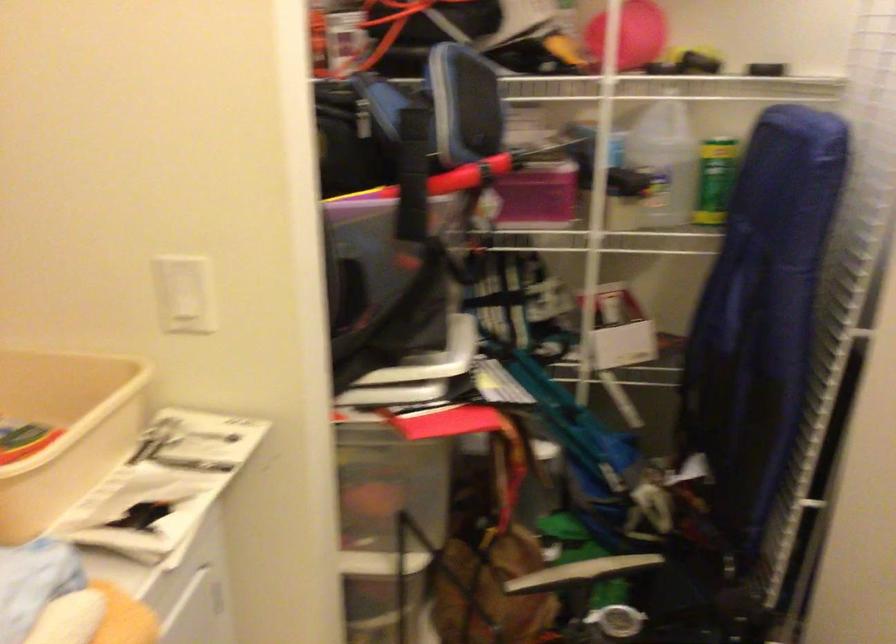
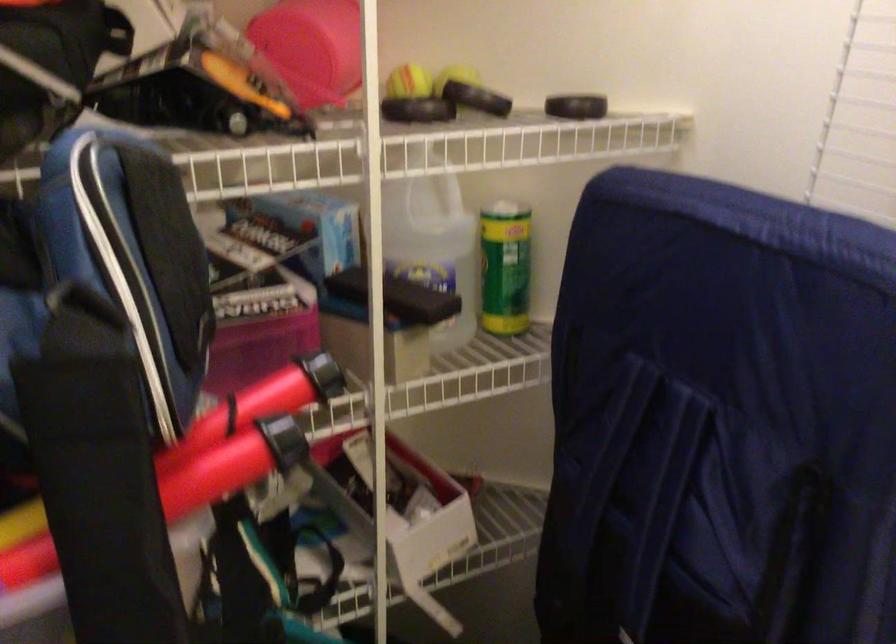
Question: The camera is either moving clockwise (left) or counter-clockwise (right) around the object. The first image is from the beginning of the video and the second image is from the end. Is the camera moving left or right when shooting the video?

Choices:
 (A) Left
 (B) Right

Answer: (A)